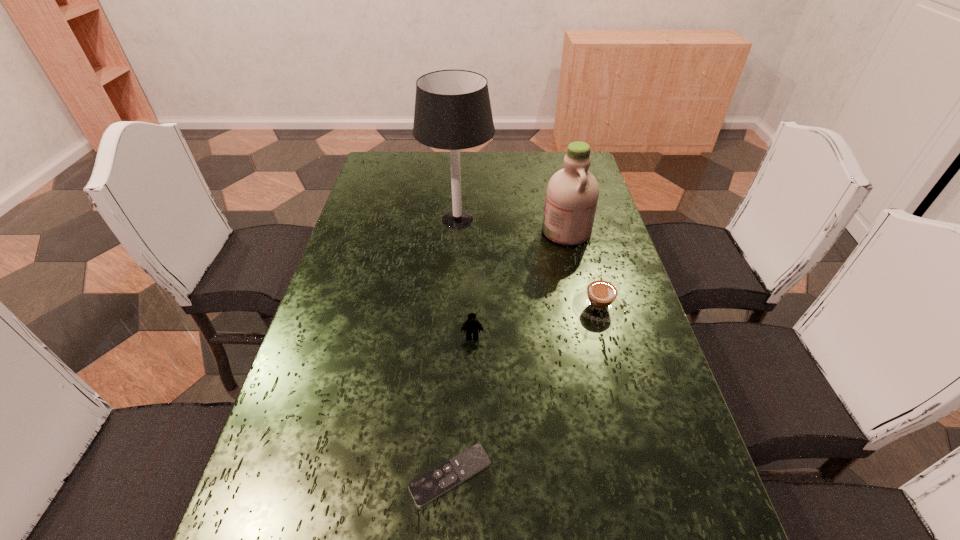
Find the location of a particular element. Image resolution: width=960 pixels, height=540 pixels. object that can be found as the second closest to the second nearest object is located at coordinates (429, 486).

I want to click on blank area in the image that satisfies the following two spatial constraints: 1. on the front label of the cleansing agent; 2. on the face of the fourth farthest object, so click(x=591, y=337).

The image size is (960, 540). Find the location of `free spot that satisfies the following two spatial constraints: 1. on the front label of the fourth shortest object; 2. on the face of the second nearest object`. free spot that satisfies the following two spatial constraints: 1. on the front label of the fourth shortest object; 2. on the face of the second nearest object is located at coordinates (591, 337).

The width and height of the screenshot is (960, 540). Find the location of `free space that satisfies the following two spatial constraints: 1. on the front label of the cleansing agent; 2. on the face of the Lego`. free space that satisfies the following two spatial constraints: 1. on the front label of the cleansing agent; 2. on the face of the Lego is located at coordinates (591, 337).

The width and height of the screenshot is (960, 540). I want to click on vacant region that satisfies the following two spatial constraints: 1. on the front label of the fourth shortest object; 2. on the front side of the shortest object, so click(624, 475).

Locate an element on the screen. The width and height of the screenshot is (960, 540). free space in the image that satisfies the following two spatial constraints: 1. on the front side of the table lamp; 2. on the left side of the third nearest object is located at coordinates (452, 306).